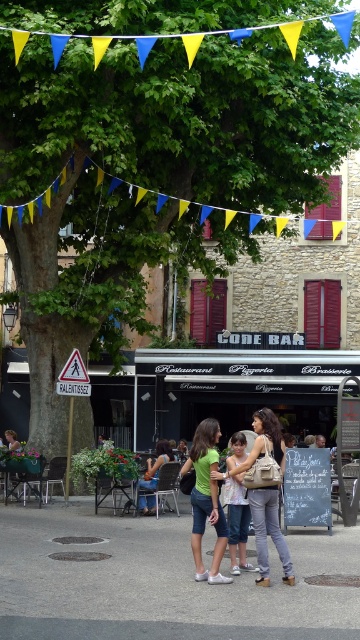
You are a food truck driver who just arrived at the scene. You need to park your truck exactly 15 meters away from the denim shorts at center. Is the current position of the black canvas food truck at center too close or too far?

The black canvas food truck at center is currently 13.87 meters from the denim shorts at center, which is closer than the required 15 meters. Therefore, the truck is parked too close and needs to be moved further away to meet the distance requirement.